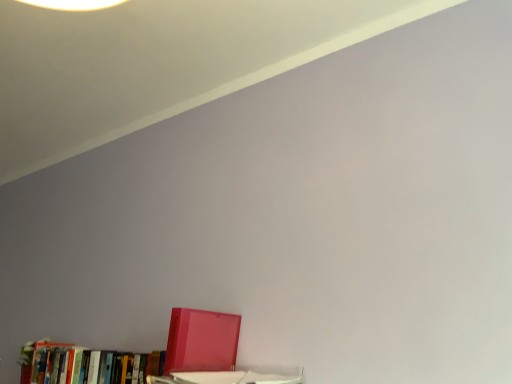
Question: Is glossy plastic binder at lower left, acting as the 2th book starting from the left, positioned beyond the bounds of matte red book at lower left, placed as the first book when sorted from left to right?

Choices:
 (A) yes
 (B) no

Answer: (A)

Question: Can you confirm if glossy plastic binder at lower left, acting as the first book starting from the right, is wider than matte red book at lower left, placed as the first book when sorted from left to right?

Choices:
 (A) yes
 (B) no

Answer: (A)

Question: Is glossy plastic binder at lower left, acting as the first book starting from the right, behind matte red book at lower left, placed as the first book when sorted from left to right?

Choices:
 (A) no
 (B) yes

Answer: (A)

Question: Could matte red book at lower left, placed as the first book when sorted from left to right, be considered to be inside glossy plastic binder at lower left, acting as the first book starting from the right?

Choices:
 (A) no
 (B) yes

Answer: (A)

Question: From the image's perspective, is glossy plastic binder at lower left, acting as the first book starting from the right, beneath matte red book at lower left, the second book in the right-to-left sequence?

Choices:
 (A) no
 (B) yes

Answer: (A)

Question: Considering the relative positions of glossy plastic binder at lower left, acting as the 2th book starting from the left, and matte red book at lower left, placed as the first book when sorted from left to right, in the image provided, is glossy plastic binder at lower left, acting as the 2th book starting from the left, to the right of matte red book at lower left, placed as the first book when sorted from left to right, from the viewer's perspective?

Choices:
 (A) yes
 (B) no

Answer: (A)

Question: Considering the relative positions of matte red book at lower left, placed as the first book when sorted from left to right, and glossy plastic binder at lower left, acting as the first book starting from the right, in the image provided, is matte red book at lower left, placed as the first book when sorted from left to right, to the left of glossy plastic binder at lower left, acting as the first book starting from the right, from the viewer's perspective?

Choices:
 (A) yes
 (B) no

Answer: (A)

Question: Is matte red book at lower left, the second book in the right-to-left sequence, bigger than glossy plastic binder at lower left, acting as the 2th book starting from the left?

Choices:
 (A) no
 (B) yes

Answer: (B)

Question: Considering the relative positions of matte red book at lower left, the second book in the right-to-left sequence, and glossy plastic binder at lower left, acting as the first book starting from the right, in the image provided, is matte red book at lower left, the second book in the right-to-left sequence, in front of glossy plastic binder at lower left, acting as the first book starting from the right,?

Choices:
 (A) no
 (B) yes

Answer: (A)

Question: From a real-world perspective, is matte red book at lower left, the second book in the right-to-left sequence, located beneath glossy plastic binder at lower left, acting as the first book starting from the right?

Choices:
 (A) no
 (B) yes

Answer: (B)

Question: From the image's perspective, would you say matte red book at lower left, placed as the first book when sorted from left to right, is positioned over glossy plastic binder at lower left, acting as the 2th book starting from the left?

Choices:
 (A) yes
 (B) no

Answer: (B)

Question: Does matte red book at lower left, placed as the first book when sorted from left to right, have a greater width compared to glossy plastic binder at lower left, acting as the 2th book starting from the left?

Choices:
 (A) no
 (B) yes

Answer: (A)

Question: Considering the relative positions of matte red book at lower left, placed as the first book when sorted from left to right, and glossy plastic binder at lower left, acting as the 2th book starting from the left, in the image provided, is matte red book at lower left, placed as the first book when sorted from left to right, to the left or to the right of glossy plastic binder at lower left, acting as the 2th book starting from the left,?

Choices:
 (A) left
 (B) right

Answer: (A)